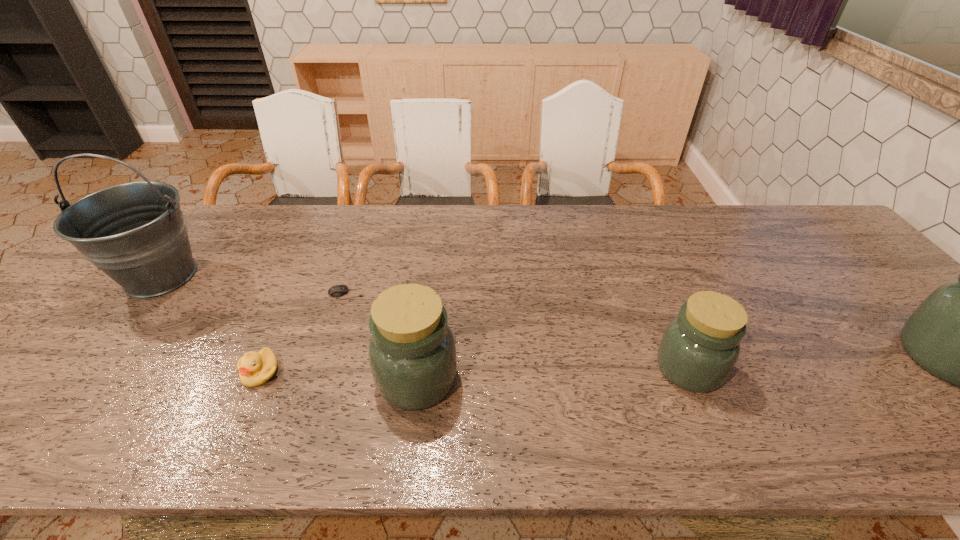
Please point a spot to add another jar on the left. Please provide its 2D coordinates. Your answer should be formatted as a tuple, i.e. [(x, y)], where the tuple contains the x and y coordinates of a point satisfying the conditions above.

[(132, 390)]